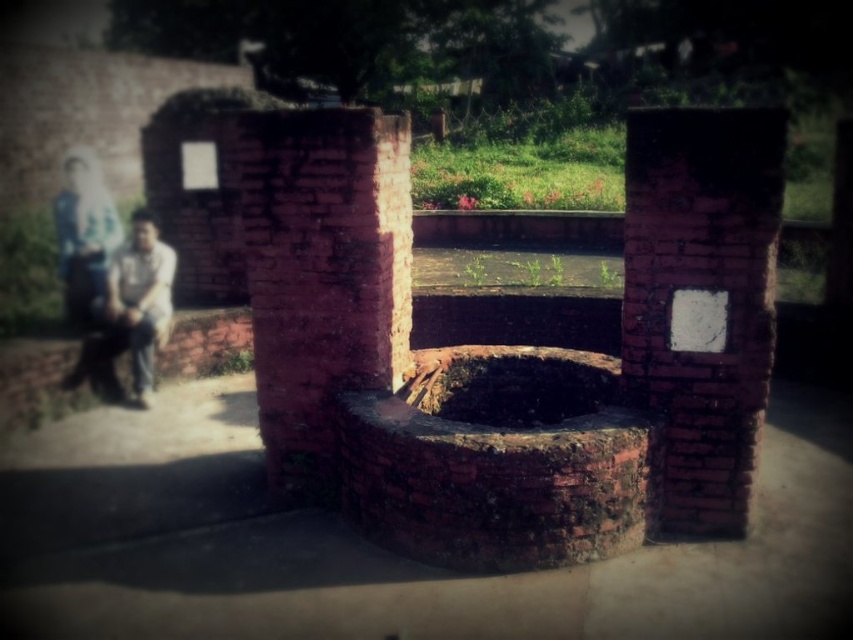
Question: Does rusty brick fire pit at center appear on the left side of red brick pillar at center?

Choices:
 (A) no
 (B) yes

Answer: (A)

Question: Which point appears closest to the camera in this image?

Choices:
 (A) (514, 513)
 (B) (764, 243)
 (C) (299, 448)

Answer: (A)

Question: Estimate the real-world distances between objects in this image. Which object is farther from the brick wall at center?

Choices:
 (A) red brick pillar at center
 (B) rusty brick fire pit at center
 (C) light brown leather jacket at left

Answer: (C)

Question: Which object appears farthest from the camera in this image?

Choices:
 (A) light brown leather jacket at left
 (B) rusty brick fire pit at center

Answer: (A)

Question: Is the position of rusty brick fire pit at center less distant than that of red brick pillar at center?

Choices:
 (A) no
 (B) yes

Answer: (B)

Question: Is rusty brick fire pit at center further to the viewer compared to light brown leather jacket at left?

Choices:
 (A) yes
 (B) no

Answer: (B)